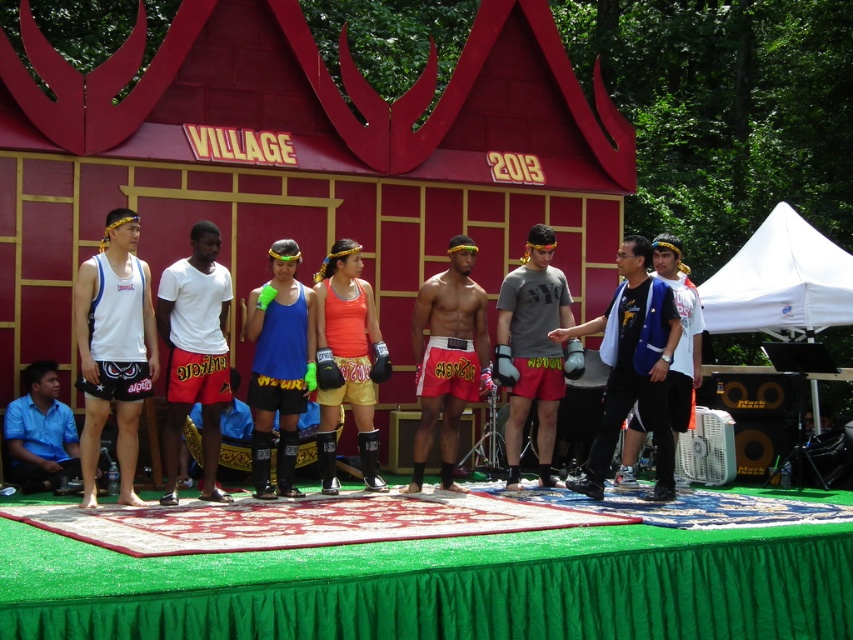
You are a photographer standing at the back of the venue. You want to capture a closeup shot of the green artificial turf at center. Given that your camera can focus on objects up to 10 meters away, will you be able to take the photo without moving closer?

The green artificial turf at center is 10.66 meters away from the camera. Since the camera can only focus up to 10 meters, you will need to move closer to take the closeup shot.

You are a photographer standing at the back of the stage. You want to take a photo that includes both the point at point (750,328) and point (207,472). Which point is closer to your camera?

Point (207,472) is closer to the camera because it is less further than point (750,328).